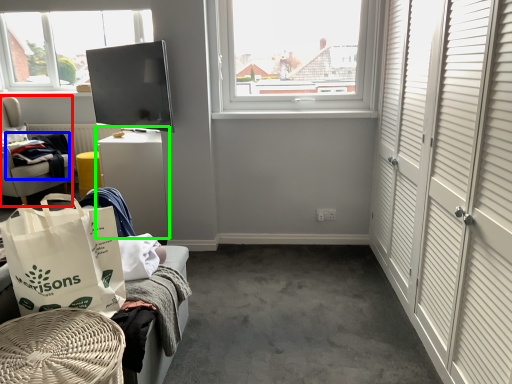
Question: Estimate the real-world distances between objects in this image. Which object is farther from furniture (highlighted by a red box), clothing (highlighted by a blue box) or table (highlighted by a green box)?

Choices:
 (A) clothing
 (B) table

Answer: (B)